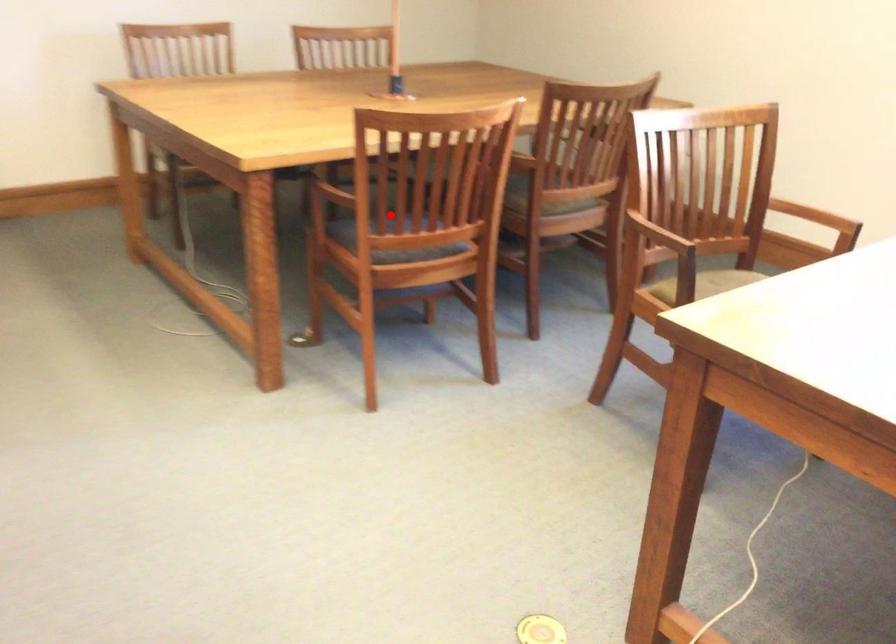
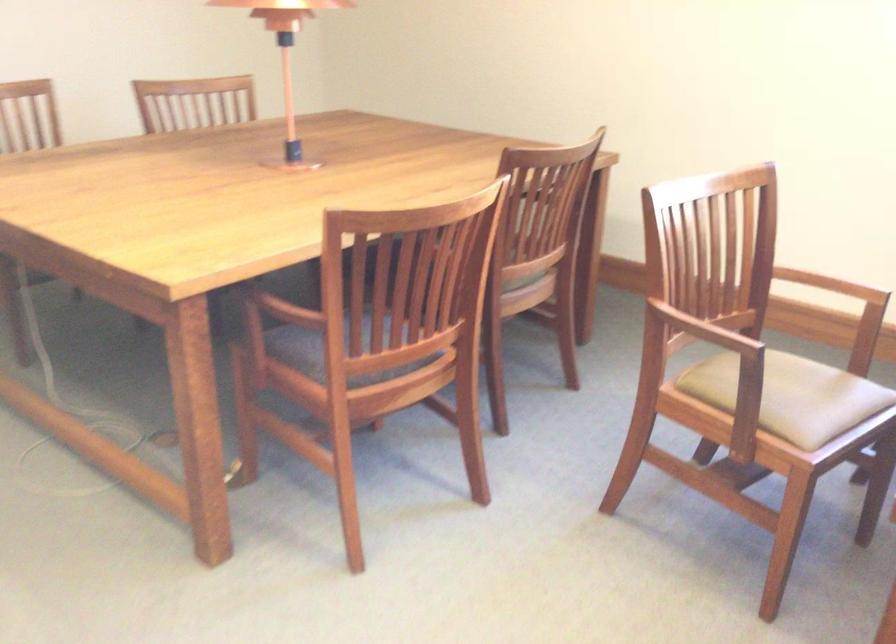
Question: I am providing you with two images of the same scene from different viewpoints. Image1 has a red point marked. In image2, the corresponding 3D location appears at what relative position? Reply with the corresponding letter.

Choices:
 (A) Closer
 (B) Farther

Answer: (A)